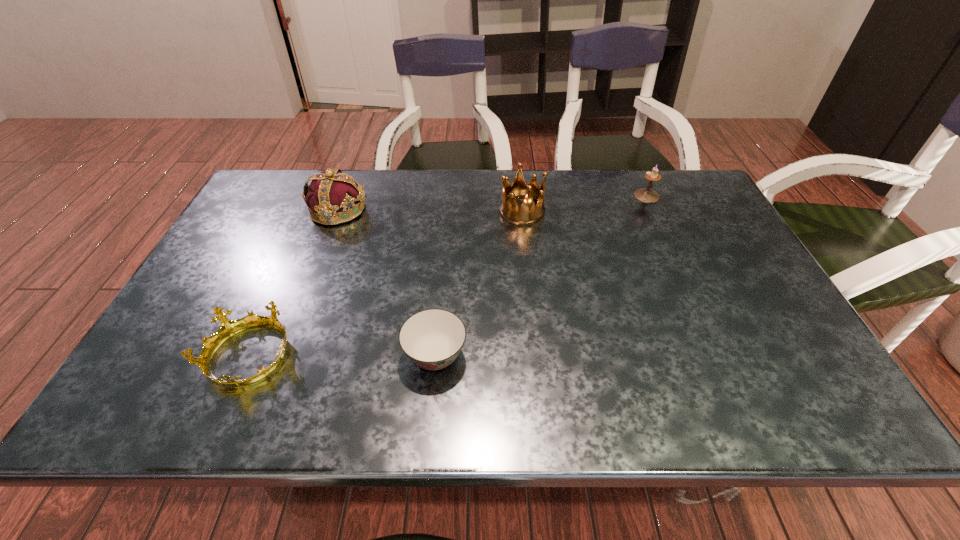
Identify the location of the fourth object from left to right. click(529, 213).

Find the location of `the rightmost object`. the rightmost object is located at coordinates (644, 195).

Where is `the third object from right to left`? This screenshot has width=960, height=540. the third object from right to left is located at coordinates (432, 338).

At what (x,y) coordinates should I click in order to perform the action: click on the nearest crown. Please return your answer as a coordinate pair (x, y). Looking at the image, I should click on (228, 328).

At what (x,y) coordinates should I click in order to perform the action: click on free region located on the front of the second object from right to left. Please return your answer as a coordinate pair (x, y). This screenshot has height=540, width=960. Looking at the image, I should click on (526, 253).

This screenshot has width=960, height=540. I want to click on vacant region located 0.390m on the left of the rightmost object, so (x=510, y=196).

What are the coordinates of `free space located on the back of the soup bowl` in the screenshot? It's located at (446, 222).

Identify the location of vacant space located 0.290m on the right of the nearest crown. The height and width of the screenshot is (540, 960). (427, 356).

This screenshot has height=540, width=960. I want to click on candle holder at the far edge, so click(x=644, y=195).

Where is `soup bowl that is at the near edge`? The width and height of the screenshot is (960, 540). soup bowl that is at the near edge is located at coordinates (432, 338).